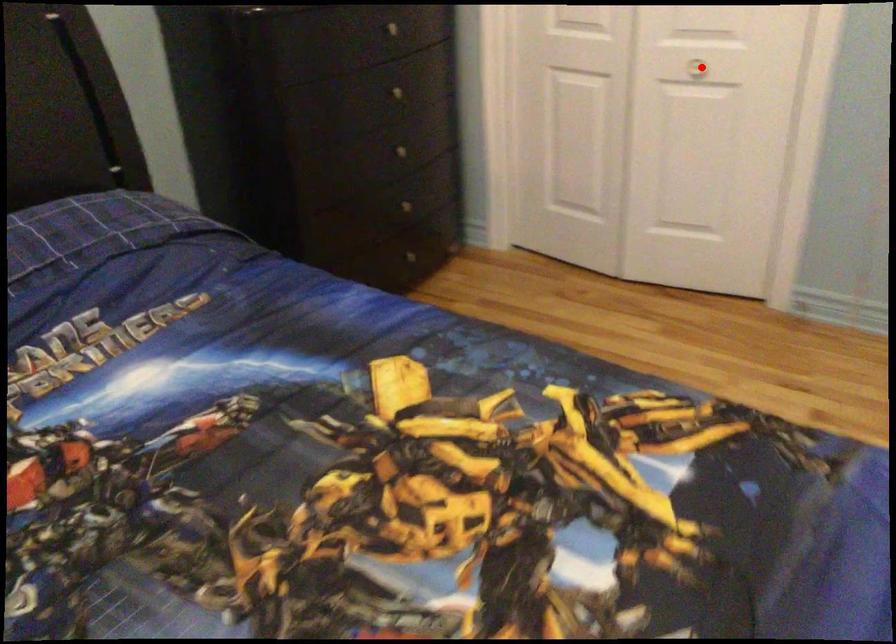
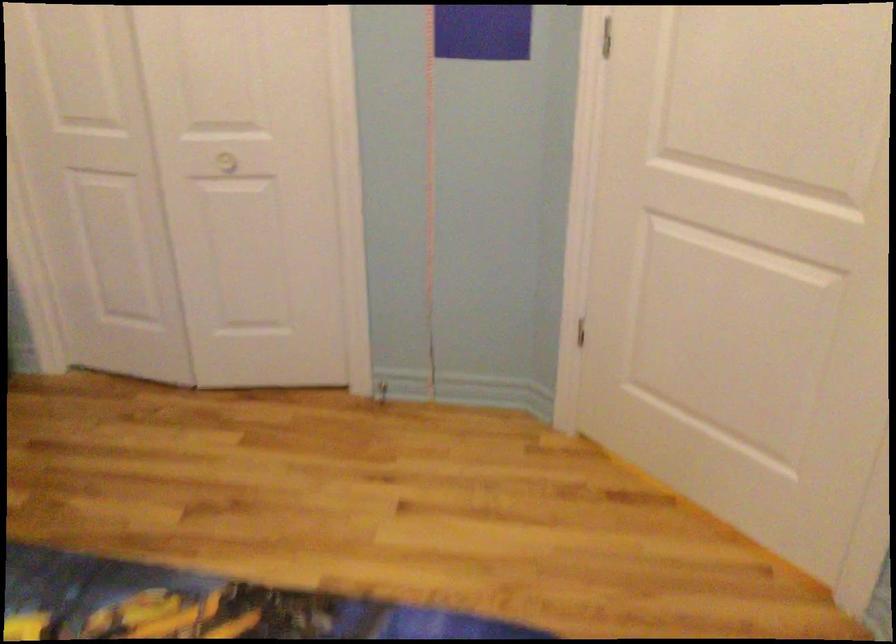
The point at the highlighted location is marked in the first image. Where is the corresponding point in the second image?

(227, 162)